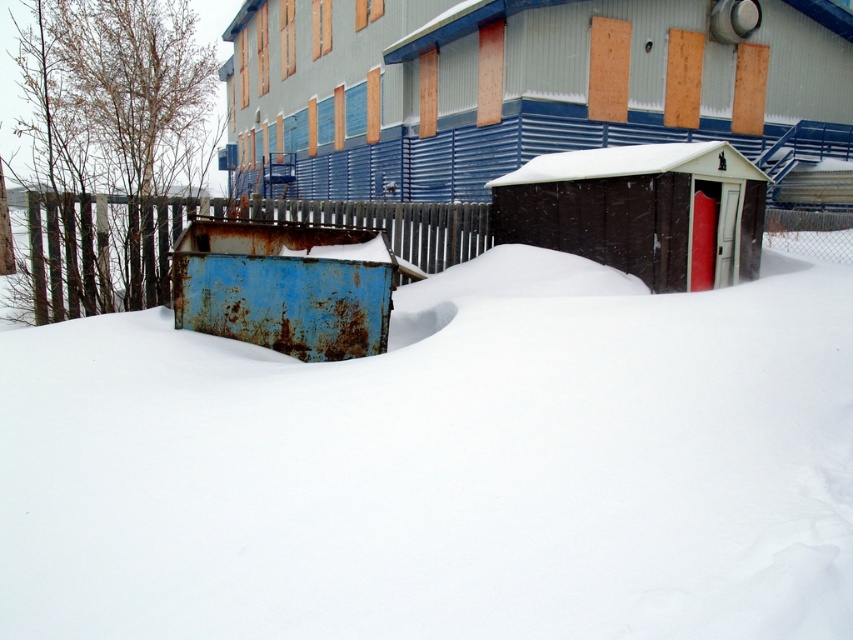
Question: Can you confirm if white fluffy snow at center is smaller than brown wooden shed at upper center?

Choices:
 (A) yes
 (B) no

Answer: (A)

Question: Among these objects, which one is farthest from the camera?

Choices:
 (A) brown plastic shed at center-right
 (B) white fluffy snow at center

Answer: (A)

Question: Is white fluffy snow at center thinner than brown wooden shed at upper center?

Choices:
 (A) no
 (B) yes

Answer: (B)

Question: Which of the following is the closest to the observer?

Choices:
 (A) (717, 428)
 (B) (82, 291)

Answer: (A)

Question: Does white fluffy snow at center appear over brown plastic shed at center-right?

Choices:
 (A) no
 (B) yes

Answer: (A)

Question: Which object is farther from the camera taking this photo?

Choices:
 (A) rusty metal fence at center
 (B) white fluffy snow at center

Answer: (A)